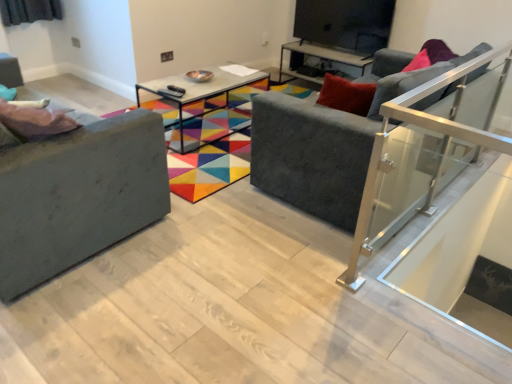
At what (x,y) coordinates should I click in order to perform the action: click on pink fabric pillow at left. Please return your answer as a coordinate pair (x, y). The height and width of the screenshot is (384, 512). Looking at the image, I should click on (34, 121).

The width and height of the screenshot is (512, 384). What do you see at coordinates (317, 58) in the screenshot?
I see `metallic glass table at center, the first table when ordered from back to front` at bounding box center [317, 58].

The width and height of the screenshot is (512, 384). Identify the location of matte gray couch at left, the 1th studio couch viewed from the left. (78, 189).

Is point (387, 91) behind point (186, 82)?

That is False.

Considering the relative sizes of velvet grey couch at center, the 2th studio couch in the left-to-right sequence, and metallic glass table at center, arranged as the first table when viewed from the front, in the image provided, is velvet grey couch at center, the 2th studio couch in the left-to-right sequence, taller than metallic glass table at center, arranged as the first table when viewed from the front,?

Yes.

Can you confirm if velvet grey couch at center, the 1th studio couch from the right, is smaller than metallic glass table at center, placed as the second table when sorted from back to front?

No.

Where is `the 1st studio couch directly beneath the matte black tv stand at upper center (from a real-world perspective)`? The image size is (512, 384). the 1st studio couch directly beneath the matte black tv stand at upper center (from a real-world perspective) is located at coordinates (78, 189).

Considering the relative sizes of matte black tv stand at upper center and matte gray couch at left, the 1th studio couch viewed from the left, in the image provided, is matte black tv stand at upper center taller than matte gray couch at left, the 1th studio couch viewed from the left,?

Incorrect, the height of matte black tv stand at upper center is not larger of that of matte gray couch at left, the 1th studio couch viewed from the left.

How different are the orientations of matte black tv stand at upper center and matte gray couch at left, the 1th studio couch viewed from the left, in degrees?

They differ by 177 degrees in their facing directions.

From the image's perspective, which is below, matte black tv stand at upper center or matte gray couch at left, placed as the second studio couch when sorted from right to left?

matte gray couch at left, placed as the second studio couch when sorted from right to left.

From a real-world perspective, who is located lower, metallic glass table at center, the second table viewed from the front, or metallic glass table at center, which is the 1th table from left to right?

Answer: metallic glass table at center, the second table viewed from the front.

Is the depth of metallic glass table at center, placed as the first table when sorted from right to left, greater than that of metallic glass table at center, placed as the second table when sorted from back to front?

That is True.

Considering the sizes of metallic glass table at center, the first table when ordered from back to front, and metallic glass table at center, which is the 1th table from left to right, in the image, is metallic glass table at center, the first table when ordered from back to front, taller or shorter than metallic glass table at center, which is the 1th table from left to right,?

In the image, metallic glass table at center, the first table when ordered from back to front, appears to be shorter than metallic glass table at center, which is the 1th table from left to right.

Can you confirm if metallic glass table at center, the second table viewed from the front, is bigger than metallic glass table at center, placed as the second table when sorted from back to front?

Incorrect, metallic glass table at center, the second table viewed from the front, is not larger than metallic glass table at center, placed as the second table when sorted from back to front.

Could you measure the distance between matte gray couch at left, placed as the second studio couch when sorted from right to left, and velvet grey couch at center, the 1th studio couch from the right?

matte gray couch at left, placed as the second studio couch when sorted from right to left, and velvet grey couch at center, the 1th studio couch from the right, are 38.95 inches apart from each other.

Can you confirm if matte gray couch at left, placed as the second studio couch when sorted from right to left, is thinner than velvet grey couch at center, the 2th studio couch in the left-to-right sequence?

Yes, matte gray couch at left, placed as the second studio couch when sorted from right to left, is thinner than velvet grey couch at center, the 2th studio couch in the left-to-right sequence.

In terms of height, does matte gray couch at left, placed as the second studio couch when sorted from right to left, look taller or shorter compared to velvet grey couch at center, the 1th studio couch from the right?

Considering their sizes, matte gray couch at left, placed as the second studio couch when sorted from right to left, has less height than velvet grey couch at center, the 1th studio couch from the right.

Can you tell me how much matte gray couch at left, placed as the second studio couch when sorted from right to left, and velvet grey couch at center, the 2th studio couch in the left-to-right sequence, differ in facing direction?

The angular difference between matte gray couch at left, placed as the second studio couch when sorted from right to left, and velvet grey couch at center, the 2th studio couch in the left-to-right sequence, is 89.6 degrees.

From a real-world perspective, is metallic glass table at center, the second table positioned from the left, positioned above or below pink fabric pillow at left?

metallic glass table at center, the second table positioned from the left, is situated lower than pink fabric pillow at left in the real world.

Is metallic glass table at center, the first table when ordered from back to front, in front of pink fabric pillow at left?

No.

Between metallic glass table at center, the first table when ordered from back to front, and pink fabric pillow at left, which one appears on the right side from the viewer's perspective?

From the viewer's perspective, metallic glass table at center, the first table when ordered from back to front, appears more on the right side.

Can you see metallic glass table at center, the second table positioned from the left, touching pink fabric pillow at left?

They are not placed beside each other.

Choose the correct answer: Is pink fabric pillow at left inside matte gray couch at left, the 1th studio couch viewed from the left, or outside it?

The correct answer is: inside.

How much distance is there between pink fabric pillow at left and matte gray couch at left, placed as the second studio couch when sorted from right to left?

pink fabric pillow at left and matte gray couch at left, placed as the second studio couch when sorted from right to left, are 23.96 centimeters apart.

From their relative heights in the image, would you say pink fabric pillow at left is taller or shorter than matte gray couch at left, the 1th studio couch viewed from the left?

Considering their sizes, pink fabric pillow at left has less height than matte gray couch at left, the 1th studio couch viewed from the left.

Does point (38, 114) lie behind point (147, 116)?

No, it is in front of (147, 116).

Are matte black tv stand at upper center and velvet grey couch at center, the 1th studio couch from the right, far apart?

Yes, matte black tv stand at upper center and velvet grey couch at center, the 1th studio couch from the right, are quite far apart.

From a real-world perspective, is matte black tv stand at upper center beneath velvet grey couch at center, the 1th studio couch from the right?

No, from a real-world perspective, matte black tv stand at upper center is not beneath velvet grey couch at center, the 1th studio couch from the right.

Does point (341, 0) come behind point (260, 112)?

Yes, it is behind point (260, 112).

Is matte black tv stand at upper center further to the viewer compared to velvet grey couch at center, the 2th studio couch in the left-to-right sequence?

Yes, it is.

I want to click on the 1st table positioned above the velvet grey couch at center, the 1th studio couch from the right (from the image's perspective), so click(195, 97).

You are a GUI agent. You are given a task and a screenshot of the screen. Output one action in this format:
    pyautogui.click(x=<x>, y=<y>)
    Task: Click on the entertainment center located behind the matte gray couch at left, placed as the second studio couch when sorted from right to left
    
    Given the screenshot: What is the action you would take?
    pyautogui.click(x=338, y=33)

Looking at the image, which one is located closer to metallic glass table at center, placed as the first table when sorted from right to left, metallic glass table at center, arranged as the 2th table when viewed from the right, or matte gray couch at left, placed as the second studio couch when sorted from right to left?

metallic glass table at center, arranged as the 2th table when viewed from the right.

When comparing their distances from metallic glass table at center, which is the 1th table from left to right, does matte gray couch at left, placed as the second studio couch when sorted from right to left, or pink fabric pillow at left seem closer?

matte gray couch at left, placed as the second studio couch when sorted from right to left, lies closer to metallic glass table at center, which is the 1th table from left to right, than the other object.

When comparing their distances from matte black tv stand at upper center, does metallic glass table at center, the second table viewed from the front, or pink fabric pillow at left seem closer?

Among the two, metallic glass table at center, the second table viewed from the front, is located nearer to matte black tv stand at upper center.

Considering their positions, is velvet grey couch at center, the 1th studio couch from the right, positioned closer to matte black tv stand at upper center than metallic glass table at center, placed as the second table when sorted from back to front?

metallic glass table at center, placed as the second table when sorted from back to front, lies closer to matte black tv stand at upper center than the other object.

Based on their spatial positions, is pink fabric pillow at left or matte gray couch at left, the 1th studio couch viewed from the left, further from velvet grey couch at center, the 1th studio couch from the right?

Among the two, pink fabric pillow at left is located further to velvet grey couch at center, the 1th studio couch from the right.

Based on their spatial positions, is metallic glass table at center, the second table viewed from the front, or matte gray couch at left, placed as the second studio couch when sorted from right to left, further from matte black tv stand at upper center?

matte gray couch at left, placed as the second studio couch when sorted from right to left, is further to matte black tv stand at upper center.

Which object lies further to the anchor point metallic glass table at center, arranged as the first table when viewed from the front, metallic glass table at center, the second table positioned from the left, or pink fabric pillow at left?

pink fabric pillow at left lies further to metallic glass table at center, arranged as the first table when viewed from the front, than the other object.

Based on their spatial positions, is matte gray couch at left, placed as the second studio couch when sorted from right to left, or matte black tv stand at upper center further from metallic glass table at center, arranged as the 2th table when viewed from the right?

Among the two, matte gray couch at left, placed as the second studio couch when sorted from right to left, is located further to metallic glass table at center, arranged as the 2th table when viewed from the right.

Locate an element on the screen. entertainment center located between matte gray couch at left, the 1th studio couch viewed from the left, and velvet grey couch at center, the 2th studio couch in the left-to-right sequence, in the left-right direction is located at coordinates coord(338,33).

What are the coordinates of `pillow between velvet grey couch at center, the 2th studio couch in the left-to-right sequence, and metallic glass table at center, placed as the first table when sorted from right to left, in the front-back direction` in the screenshot? It's located at (34, 121).

Locate an element on the screen. pillow located between matte gray couch at left, the 1th studio couch viewed from the left, and velvet grey couch at center, the 2th studio couch in the left-to-right sequence, in the left-right direction is located at coordinates (34, 121).

Where is `table between velvet grey couch at center, the 1th studio couch from the right, and metallic glass table at center, the second table positioned from the left, along the z-axis`? This screenshot has height=384, width=512. table between velvet grey couch at center, the 1th studio couch from the right, and metallic glass table at center, the second table positioned from the left, along the z-axis is located at coordinates (195, 97).